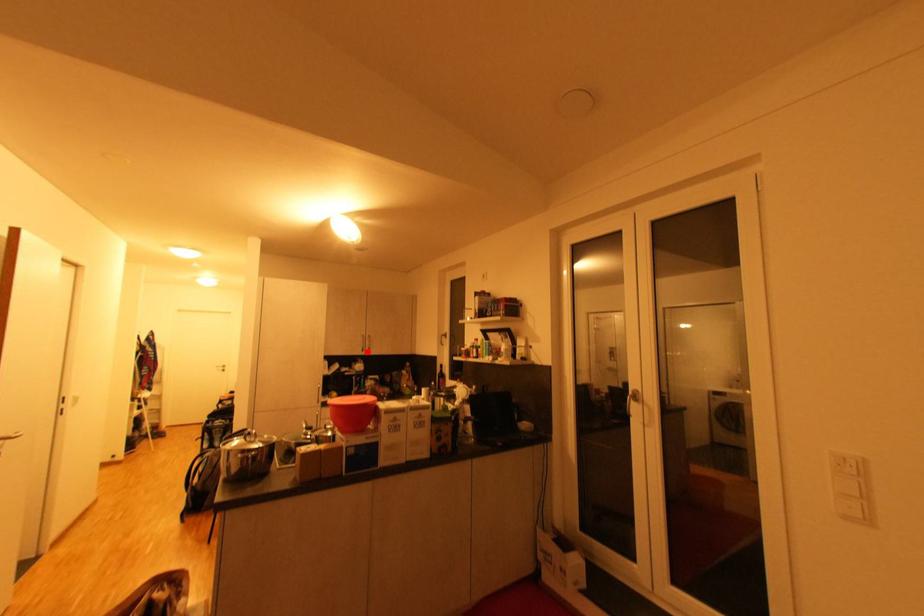
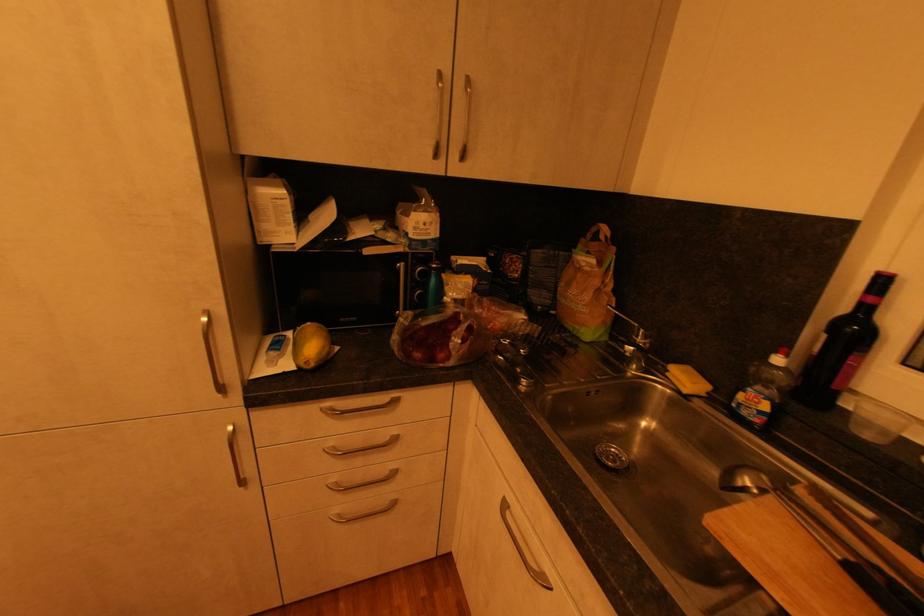
In the second image, find the point that corresponds to the highlighted location in the first image.

(441, 156)